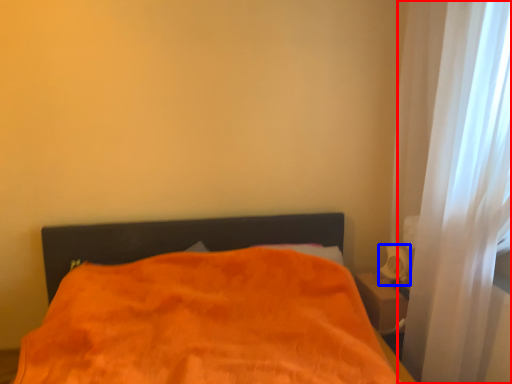
Question: Which of the following is the farthest to the observer, curtain (highlighted by a red box) or table lamp (highlighted by a blue box)?

Choices:
 (A) curtain
 (B) table lamp

Answer: (B)